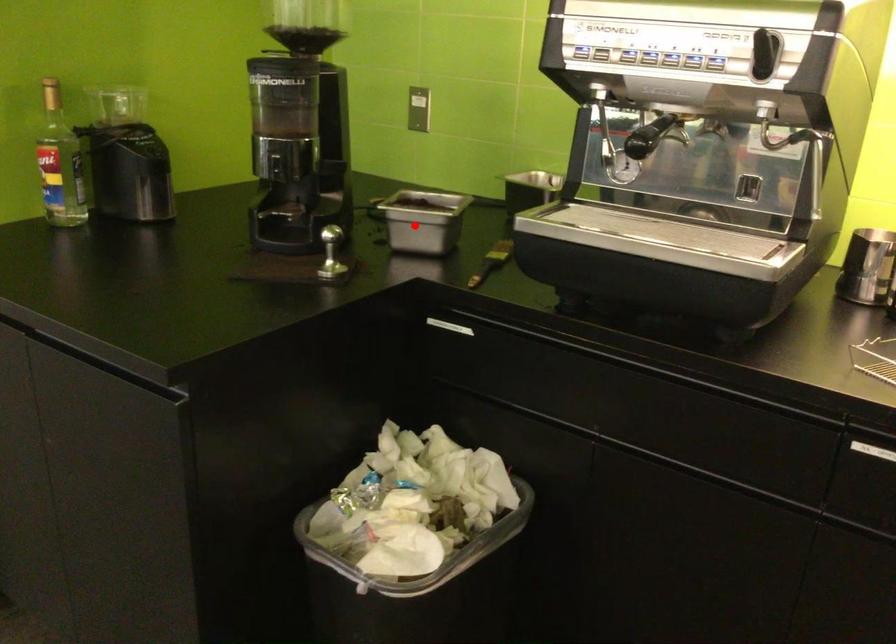
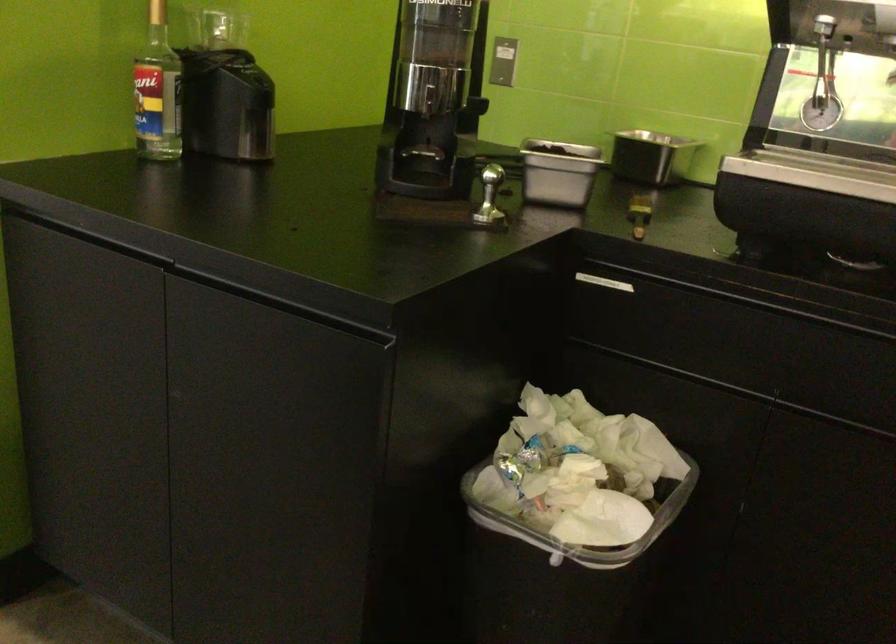
The point at the highlighted location is marked in the first image. Where is the corresponding point in the second image?

(558, 172)